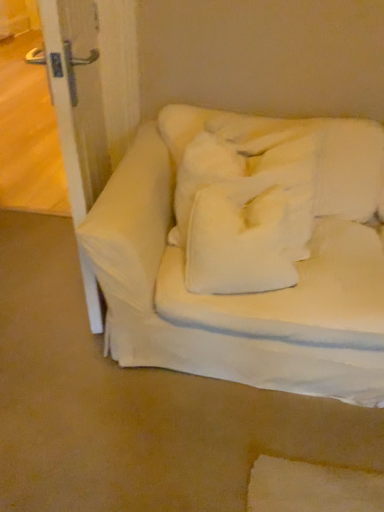
Question: Is white fabric couch at center thinner than white soft pillow at center?

Choices:
 (A) yes
 (B) no

Answer: (B)

Question: Could you tell me if white fabric couch at center is turned towards white soft pillow at center?

Choices:
 (A) yes
 (B) no

Answer: (A)

Question: Are white fabric couch at center and white soft pillow at center far apart?

Choices:
 (A) no
 (B) yes

Answer: (A)

Question: Considering the relative positions of white fabric couch at center and white soft pillow at center in the image provided, is white fabric couch at center to the left of white soft pillow at center from the viewer's perspective?

Choices:
 (A) yes
 (B) no

Answer: (B)

Question: From the image's perspective, does white fabric couch at center appear lower than white soft pillow at center?

Choices:
 (A) yes
 (B) no

Answer: (A)

Question: From the image's perspective, is white fabric couch at center located above white soft pillow at center?

Choices:
 (A) no
 (B) yes

Answer: (A)

Question: Is white soft pillow at center thinner than white fabric couch at center?

Choices:
 (A) yes
 (B) no

Answer: (A)

Question: Can you confirm if white soft pillow at center is bigger than white fabric couch at center?

Choices:
 (A) no
 (B) yes

Answer: (A)

Question: From the image's perspective, is white soft pillow at center located above white fabric couch at center?

Choices:
 (A) no
 (B) yes

Answer: (B)

Question: Is white soft pillow at center wider than white fabric couch at center?

Choices:
 (A) yes
 (B) no

Answer: (B)

Question: Does white soft pillow at center have a greater height compared to white fabric couch at center?

Choices:
 (A) yes
 (B) no

Answer: (B)

Question: Is white soft pillow at center smaller than white fabric couch at center?

Choices:
 (A) yes
 (B) no

Answer: (A)

Question: Is there a large distance between white fabric couch at center and white soft pillow at center?

Choices:
 (A) yes
 (B) no

Answer: (B)